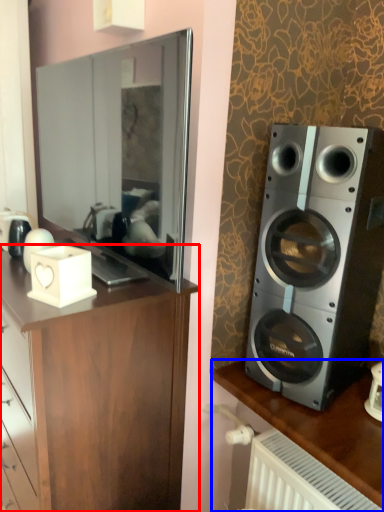
Question: Which object is further to the camera taking this photo, cabinetry (highlighted by a red box) or desk (highlighted by a blue box)?

Choices:
 (A) cabinetry
 (B) desk

Answer: (B)